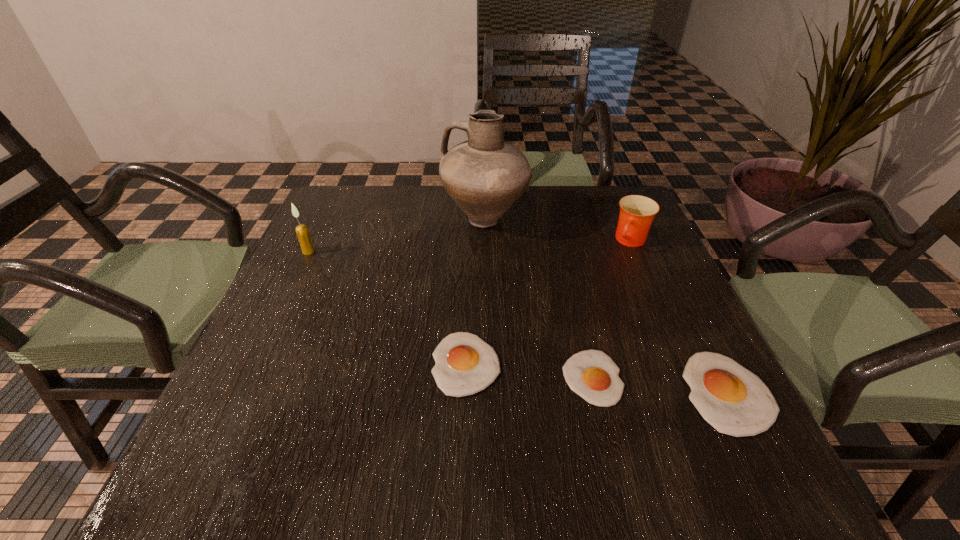
In the image, there is a desktop. Where is `blank space at the far right corner`? The width and height of the screenshot is (960, 540). blank space at the far right corner is located at coordinates (609, 199).

You are a GUI agent. You are given a task and a screenshot of the screen. Output one action in this format:
    pyautogui.click(x=<x>, y=<y>)
    Task: Click on the free space between the tallest object and the cup
    
    Given the screenshot: What is the action you would take?
    pyautogui.click(x=558, y=231)

This screenshot has height=540, width=960. Find the location of `blank region between the shortest object and the fifth shortest object`. blank region between the shortest object and the fifth shortest object is located at coordinates (450, 315).

Locate an element on the screen. vacant area that lies between the third object from right to left and the leftmost object is located at coordinates (450, 315).

I want to click on empty space that is in between the fourth shortest object and the tallest object, so click(x=558, y=231).

Where is `free space that is in between the cup and the tallest object`? free space that is in between the cup and the tallest object is located at coordinates (558, 231).

The height and width of the screenshot is (540, 960). I want to click on vacant space that's between the candle and the rightmost egg yolk, so click(x=517, y=322).

Identify the location of vacant area that lies between the tallest object and the cup. (558, 231).

Find the location of `vacant space in between the fourth object from left to right and the rightmost egg yolk`. vacant space in between the fourth object from left to right and the rightmost egg yolk is located at coordinates (x=660, y=385).

Identify the location of vacant area that lies between the fifth tallest object and the shortest egg yolk. The height and width of the screenshot is (540, 960). coord(529,371).